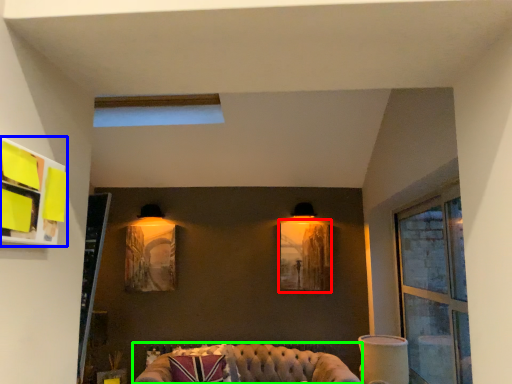
Question: Which object is the farthest from picture frame (highlighted by a red box)? Choose among these: shelf (highlighted by a blue box) or studio couch (highlighted by a green box).

Choices:
 (A) shelf
 (B) studio couch

Answer: (A)